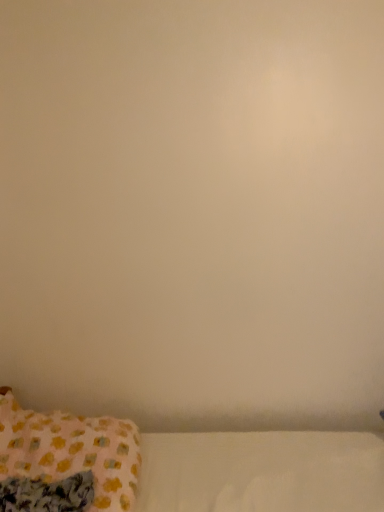
Question: Should I look upward or downward to see pink fabric pillow at lower left?

Choices:
 (A) down
 (B) up

Answer: (A)